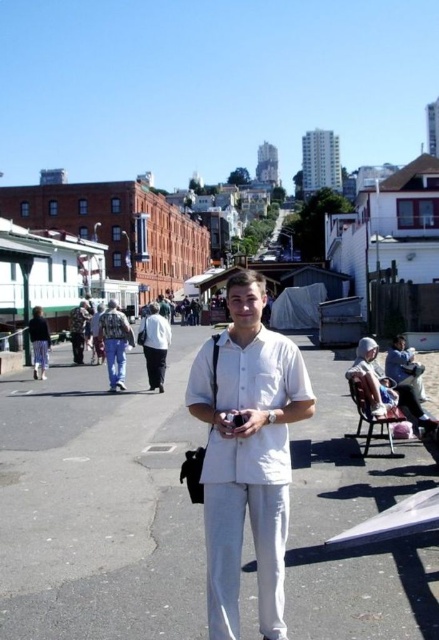
Question: Does white matte shirt at center come behind matte black pants at lower left?

Choices:
 (A) no
 (B) yes

Answer: (A)

Question: Is matte white hat at lower right thinner than denim pants at center?

Choices:
 (A) yes
 (B) no

Answer: (A)

Question: Estimate the real-world distances between objects in this image. Which object is closer to the denim pants at center?

Choices:
 (A) matte black jacket at left
 (B) matte white hat at lower right
 (C) white cotton pants at center
 (D) matte black pants at lower left

Answer: (C)

Question: Which of the following is the farthest from the observer?

Choices:
 (A) matte white hat at lower right
 (B) denim pants at center
 (C) white cotton pants at center
 (D) matte black jacket at left

Answer: (D)

Question: Does white matte shirt at center appear on the right side of matte white hat at lower right?

Choices:
 (A) no
 (B) yes

Answer: (A)

Question: Estimate the real-world distances between objects in this image. Which object is farther from the white asphalt at center?

Choices:
 (A) denim pants at center
 (B) matte black jacket at left

Answer: (B)